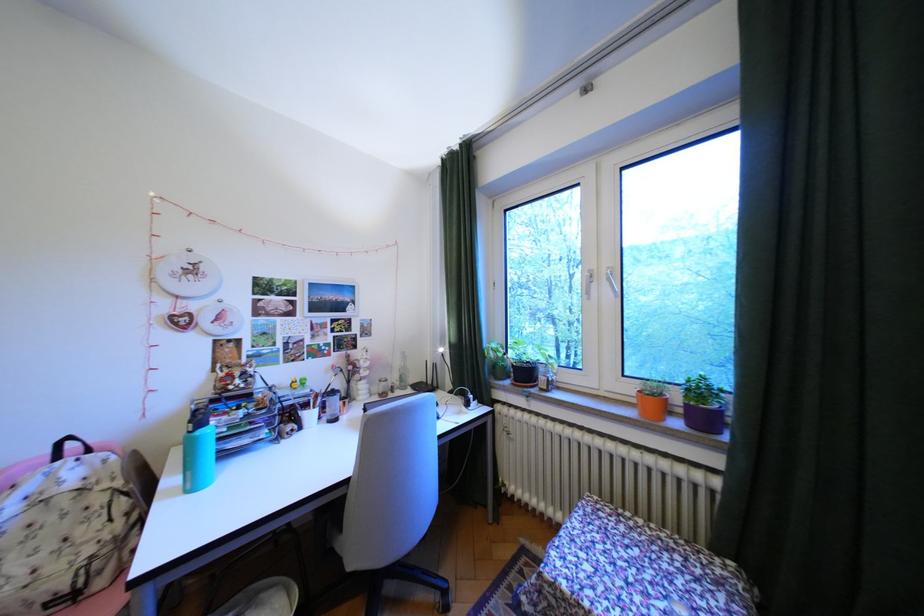
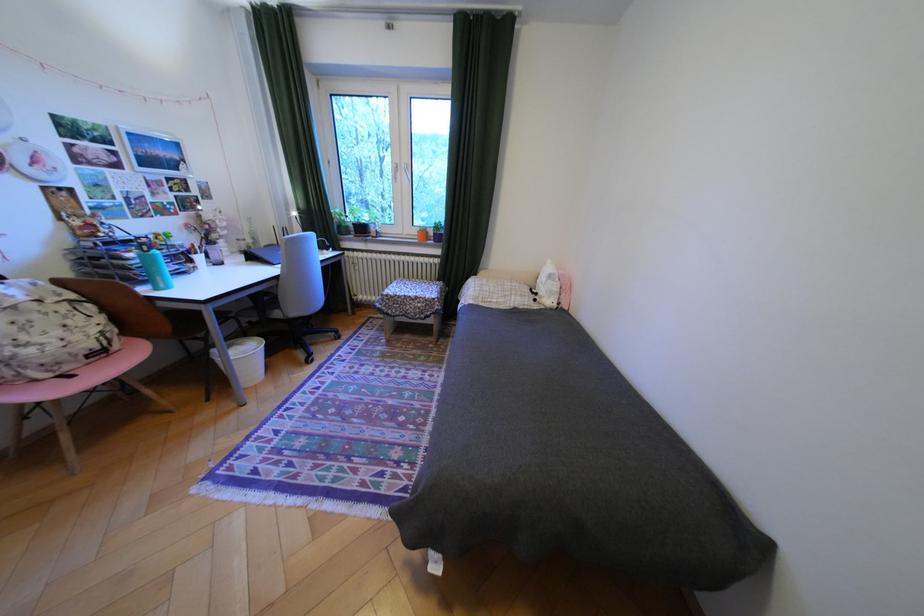
Locate, in the second image, the point that corresponds to pixel 517 369 in the first image.

(359, 227)